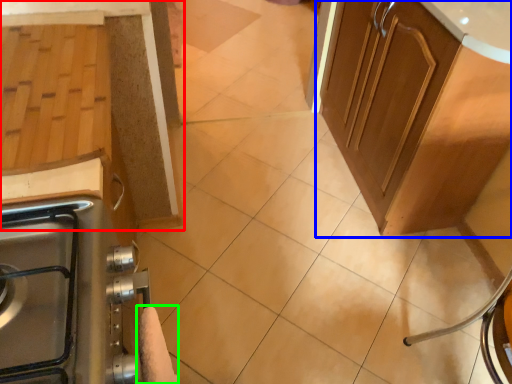
Question: Based on their relative distances, which object is nearer to cabinetry (highlighted by a red box)? Choose from cabinetry (highlighted by a blue box) and hand towel (highlighted by a green box).

Choices:
 (A) cabinetry
 (B) hand towel

Answer: (B)